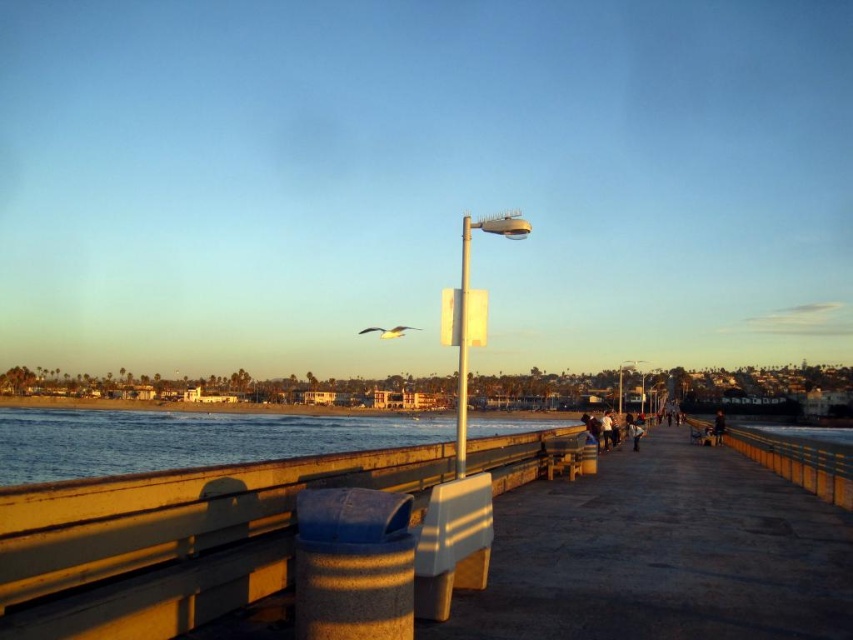
Question: Which of the following is the closest to the observer?

Choices:
 (A) (846, 468)
 (B) (466, 353)

Answer: (B)

Question: Which of the following is the farthest from the observer?

Choices:
 (A) (717, 419)
 (B) (457, 355)
 (C) (181, 602)

Answer: (A)

Question: Does smooth concrete rail at lower center appear under yellow painted wood at right?

Choices:
 (A) no
 (B) yes

Answer: (A)

Question: Which point is farther from the camera taking this photo?

Choices:
 (A) (706, 428)
 (B) (466, 308)
 (C) (724, 420)

Answer: (A)

Question: Can you confirm if metallic pole at center is positioned below white plastic pole at center?

Choices:
 (A) yes
 (B) no

Answer: (B)

Question: Does blue water at lower left have a larger size compared to metallic pole at center?

Choices:
 (A) no
 (B) yes

Answer: (B)